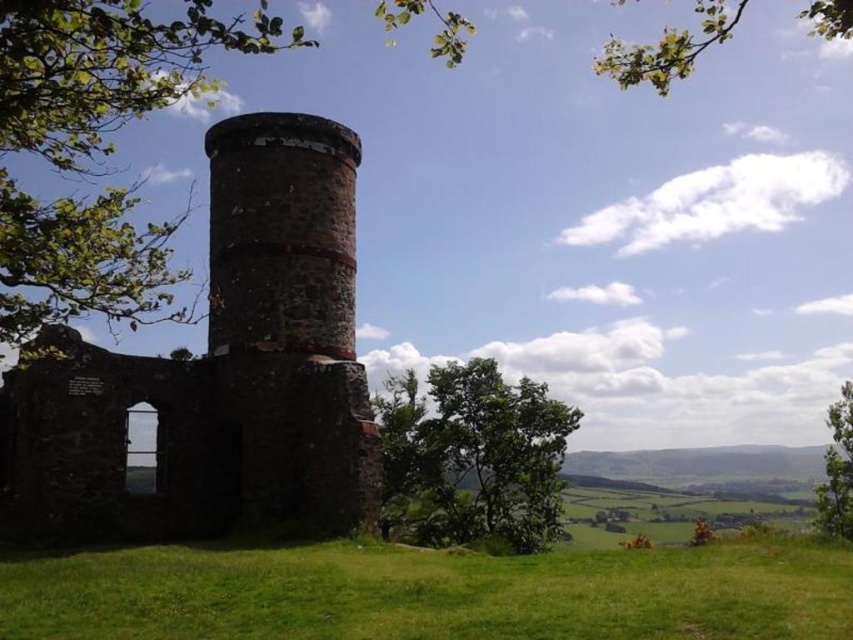
Question: Which object is farther from the camera taking this photo?

Choices:
 (A) green leafy tree at center
 (B) green leafy tree at lower right

Answer: (A)

Question: Which object appears farthest from the camera in this image?

Choices:
 (A) rustic stone tower at center
 (B) green leafy tree at upper left

Answer: (A)

Question: Where is green leafy tree at center located in relation to green leafy tree at lower right in the image?

Choices:
 (A) right
 (B) left

Answer: (B)

Question: Which object is positioned closest to the green leafy tree at center?

Choices:
 (A) green grass at lower center
 (B) green leafy tree at upper left
 (C) rustic stone tower at center
 (D) green leafy tree at lower right

Answer: (C)

Question: Is green grass at lower center to the left of green leafy tree at center from the viewer's perspective?

Choices:
 (A) no
 (B) yes

Answer: (B)

Question: Does green grass at lower center have a larger size compared to green leafy tree at center?

Choices:
 (A) no
 (B) yes

Answer: (A)